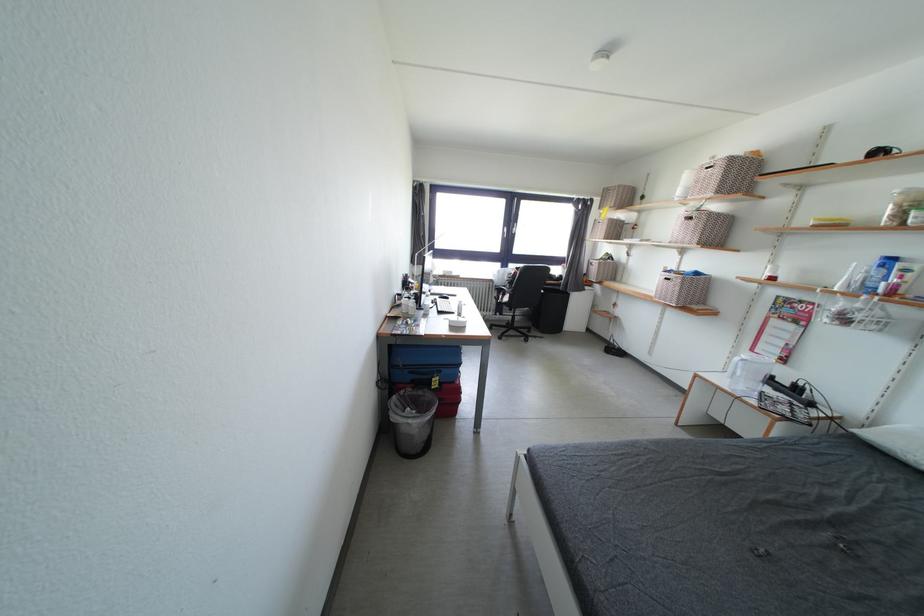
The location [440,397] corresponds to which object?

It refers to a red suitcase.